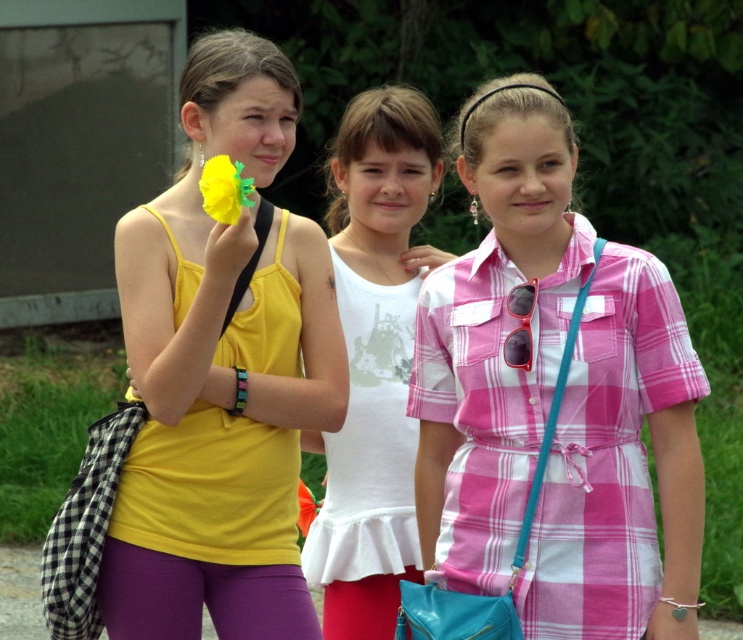
Does matte yellow tank top at center appear over white matte tank top at center?

Yes.

Does matte yellow tank top at center appear on the right side of white matte tank top at center?

In fact, matte yellow tank top at center is to the left of white matte tank top at center.

Describe the element at coordinates (221, 374) in the screenshot. The height and width of the screenshot is (640, 743). I see `matte yellow tank top at center` at that location.

The width and height of the screenshot is (743, 640). What are the coordinates of `matte yellow tank top at center` in the screenshot? It's located at (221, 374).

This screenshot has width=743, height=640. What do you see at coordinates (554, 396) in the screenshot?
I see `pink plaid dress at center` at bounding box center [554, 396].

This screenshot has width=743, height=640. I want to click on pink plaid dress at center, so click(554, 396).

Locate an element on the screen. The height and width of the screenshot is (640, 743). pink plaid dress at center is located at coordinates click(x=554, y=396).

Which is more to the left, white matte tank top at center or yellow matte flower at upper center?

yellow matte flower at upper center

Who is higher up, white matte tank top at center or yellow matte flower at upper center?

Positioned higher is yellow matte flower at upper center.

Is point (345, 445) positioned before point (233, 164)?

No, it is not.

This screenshot has height=640, width=743. In order to click on white matte tank top at center in this screenshot , I will do [x=374, y=358].